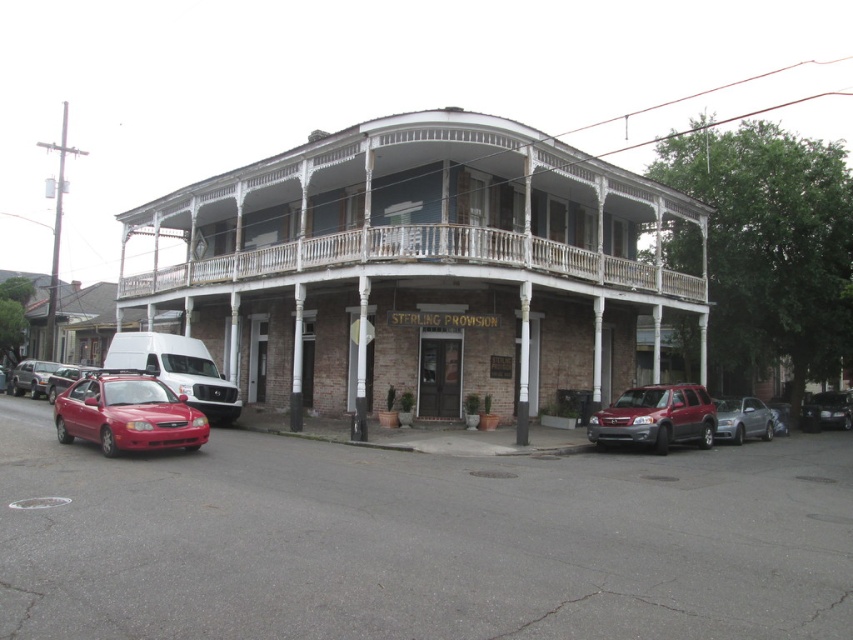
You are a delivery person trying to park your 1.5 meter tall delivery box in front of the Sterling Provision entrance. There is a white wood balcony at center and a satin silver sedan at center in the way. Can the delivery box fit between them vertically?

The white wood balcony at center is taller than the satin silver sedan at center. Since the delivery box is 1.5 meters tall, it can fit vertically between them as long as the sedan does not block the space. However, since both objects are at center, their proximity might restrict horizontal space, but vertically the balcony is higher so the box can be placed underneath it if there is enough horizontal clearance.

You are standing in front of the Sterling Provision building and want to take a photo of both the white wooden balcony at upper center and the metallic silver sedan at left. Which object should you focus on first to ensure both are in the frame?

You should focus on the white wooden balcony at upper center first because it is closer to the viewer than the metallic silver sedan at left, so adjusting the camera to include it will also capture the sedan in the background.

You are a delivery person standing next to the metallic silver sedan at left and need to deliver a package to the white wooden balcony at upper center. The delivery drone you have can only travel 10 meters. Can the drone reach the balcony?

The white wooden balcony at upper center and metallic silver sedan at left are 12.62 meters apart from each other. The drone cannot reach the balcony since the distance exceeds its 10 meter limit.